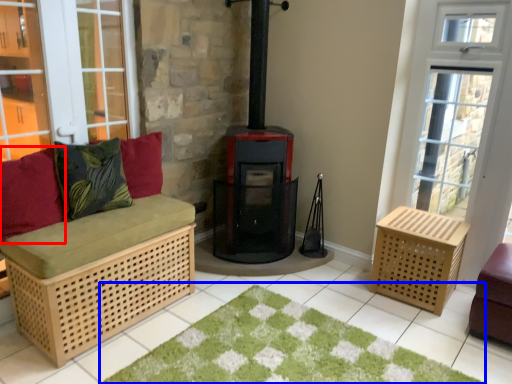
Question: Which object is closer to the camera taking this photo, pillow (highlighted by a red box) or doormat (highlighted by a blue box)?

Choices:
 (A) pillow
 (B) doormat

Answer: (B)